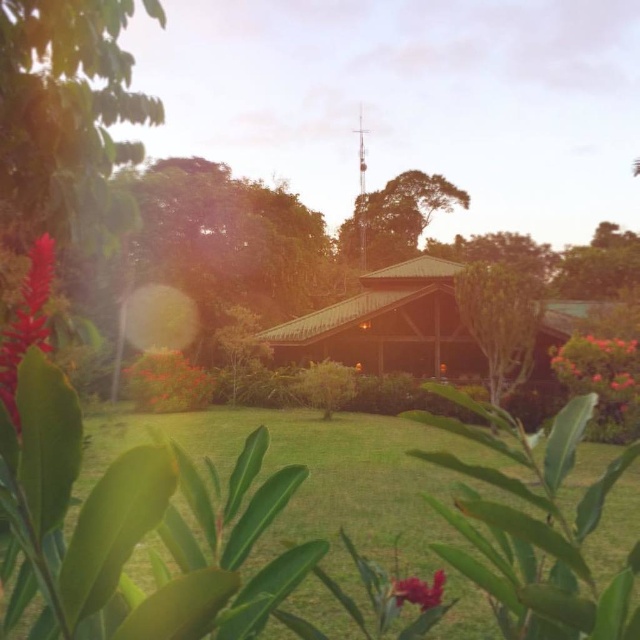
Is point (506, 337) more distant than point (148, 376)?

That is False.

Is green leafy tree at center positioned at the back of bright orange flower at center?

That is False.

Which is in front, point (506, 362) or point (172, 408)?

Positioned in front is point (506, 362).

I want to click on green leafy tree at center, so pyautogui.click(x=500, y=321).

Does green textured roof at center appear on the right side of bright pink petals at right?

In fact, green textured roof at center is to the left of bright pink petals at right.

The width and height of the screenshot is (640, 640). Identify the location of green textured roof at center. (394, 218).

Image resolution: width=640 pixels, height=640 pixels. I want to click on green textured roof at center, so click(x=394, y=218).

Where is `green textured roof at center`? This screenshot has height=640, width=640. green textured roof at center is located at coordinates (394, 218).

In the scene shown: Is green wooden hut at center to the left of matte red flower at lower center from the viewer's perspective?

Incorrect, green wooden hut at center is not on the left side of matte red flower at lower center.

Who is positioned more to the left, green wooden hut at center or matte red flower at lower center?

From the viewer's perspective, matte red flower at lower center appears more on the left side.

Find the location of a particular element. The width and height of the screenshot is (640, 640). green wooden hut at center is located at coordinates (388, 326).